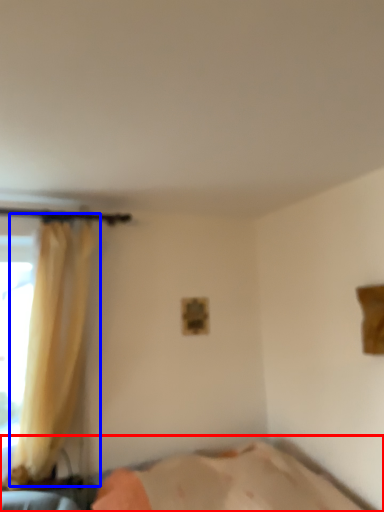
Question: Which object is further to the camera taking this photo, bed (highlighted by a red box) or curtain (highlighted by a blue box)?

Choices:
 (A) bed
 (B) curtain

Answer: (B)